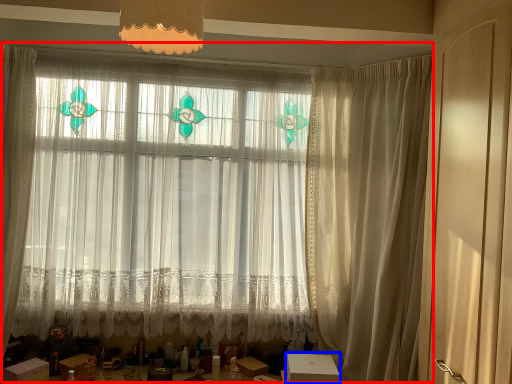
Question: Which point is further to the camera, curtain (highlighted by a red box) or cardboard box (highlighted by a blue box)?

Choices:
 (A) curtain
 (B) cardboard box

Answer: (A)